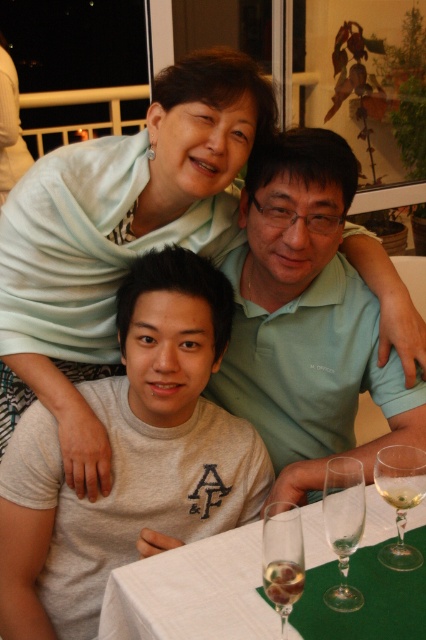
Question: Does green matte shirt at center appear under clear glass wine at lower right?

Choices:
 (A) yes
 (B) no

Answer: (B)

Question: Among these points, which one is farthest from the camera?

Choices:
 (A) (287, 566)
 (B) (348, 492)
 (C) (345, 560)

Answer: (C)

Question: Which point is farther from the camera taking this photo?

Choices:
 (A) (276, 582)
 (B) (337, 540)
 (C) (308, 275)

Answer: (C)

Question: Is green matte shirt at center positioned at the back of clear glass wine glass at center?

Choices:
 (A) no
 (B) yes

Answer: (B)

Question: Which of the following is the farthest from the observer?

Choices:
 (A) clear glass wine at center
 (B) clear glass wine glass at lower right

Answer: (B)

Question: Is white cloth table at center positioned at the back of transparent glass at table center?

Choices:
 (A) yes
 (B) no

Answer: (B)